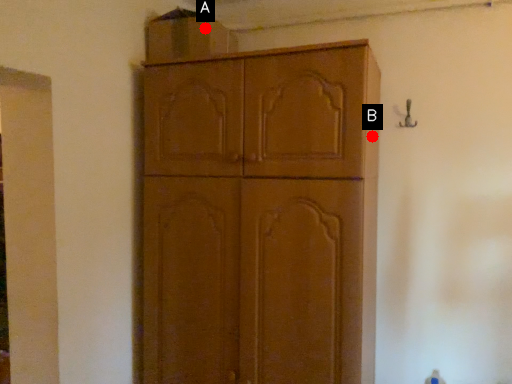
Question: Two points are circled on the image, labeled by A and B beside each circle. Which point is closer to the camera?

Choices:
 (A) A is closer
 (B) B is closer

Answer: (B)